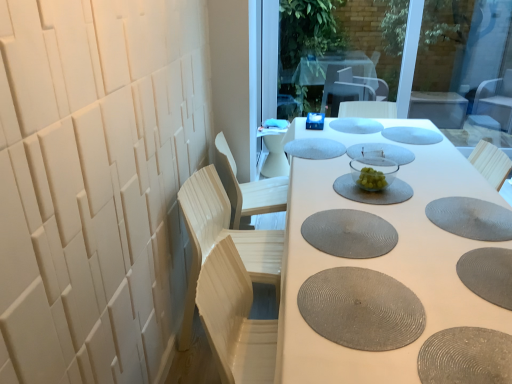
You are a GUI agent. You are given a task and a screenshot of the screen. Output one action in this format:
    pyautogui.click(x=<x>, y=<y>)
    Task: Click on the vacant space that's between gray textured placemat at center, placed as the seventh manhole cover when sorted from back to front, and gray textured placemat at center, the ninth manhole cover when ordered from back to front
    
    Given the screenshot: What is the action you would take?
    pyautogui.click(x=348, y=259)